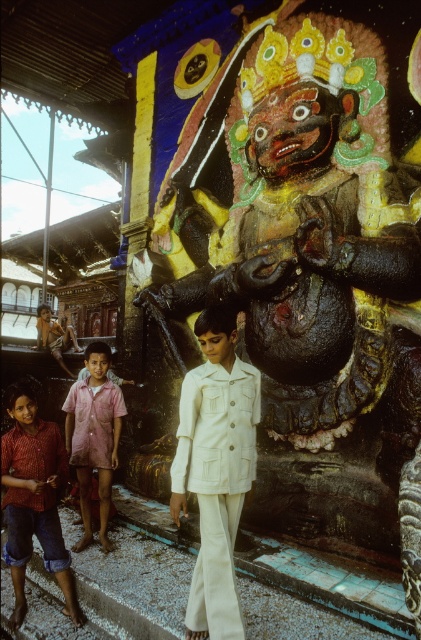
Does red plaid shirt at lower left appear under pink cotton shirt at center?

Correct, red plaid shirt at lower left is located below pink cotton shirt at center.

Is point (47, 557) farther from viewer compared to point (106, 472)?

That is False.

Locate an element on the screen. This screenshot has height=640, width=421. red plaid shirt at lower left is located at coordinates (34, 499).

Which of these two, polished bronze statue at center or red plaid shirt at lower left, stands taller?

Standing taller between the two is red plaid shirt at lower left.

Does polished bronze statue at center appear on the right side of red plaid shirt at lower left?

Indeed, polished bronze statue at center is positioned on the right side of red plaid shirt at lower left.

Which is behind, point (383, 509) or point (50, 545)?

Point (50, 545)

Image resolution: width=421 pixels, height=640 pixels. In order to click on polished bronze statue at center in this screenshot , I will do `click(306, 256)`.

Is polished bronze statue at center positioned in front of white cotton trench coat at center?

No, polished bronze statue at center is further to the viewer.

Is point (298, 128) farther from camera compared to point (210, 378)?

Yes.

What do you see at coordinates (306, 256) in the screenshot? I see `polished bronze statue at center` at bounding box center [306, 256].

Locate an element on the screen. This screenshot has width=421, height=640. polished bronze statue at center is located at coordinates (306, 256).